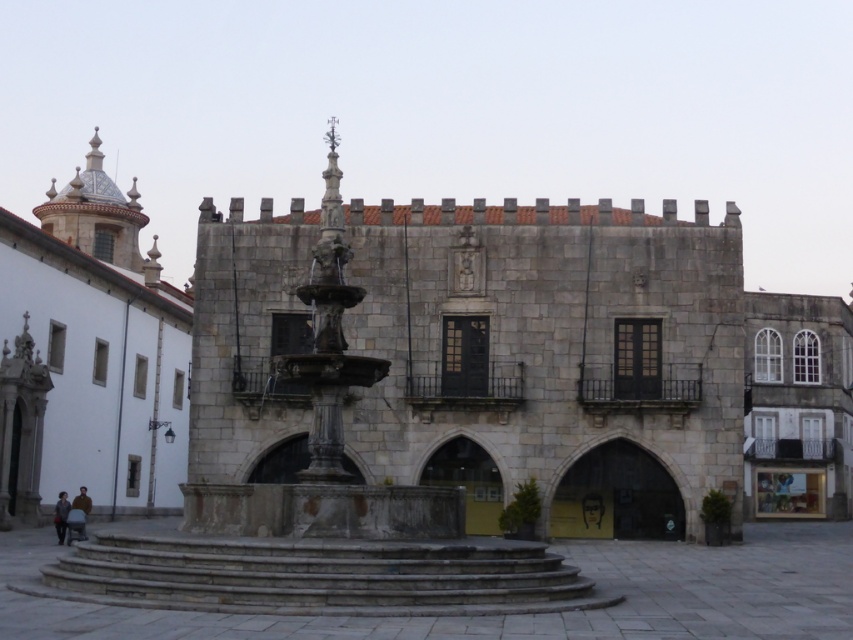
Can you confirm if dark brown leather jacket at lower left is taller than dark gray fabric jacket at lower left?

In fact, dark brown leather jacket at lower left may be shorter than dark gray fabric jacket at lower left.

Who is lower down, dark brown leather jacket at lower left or dark gray fabric jacket at lower left?

dark gray fabric jacket at lower left

Image resolution: width=853 pixels, height=640 pixels. What are the coordinates of `dark brown leather jacket at lower left` in the screenshot? It's located at (78, 515).

Where is `dark brown leather jacket at lower left`? dark brown leather jacket at lower left is located at coordinates (78, 515).